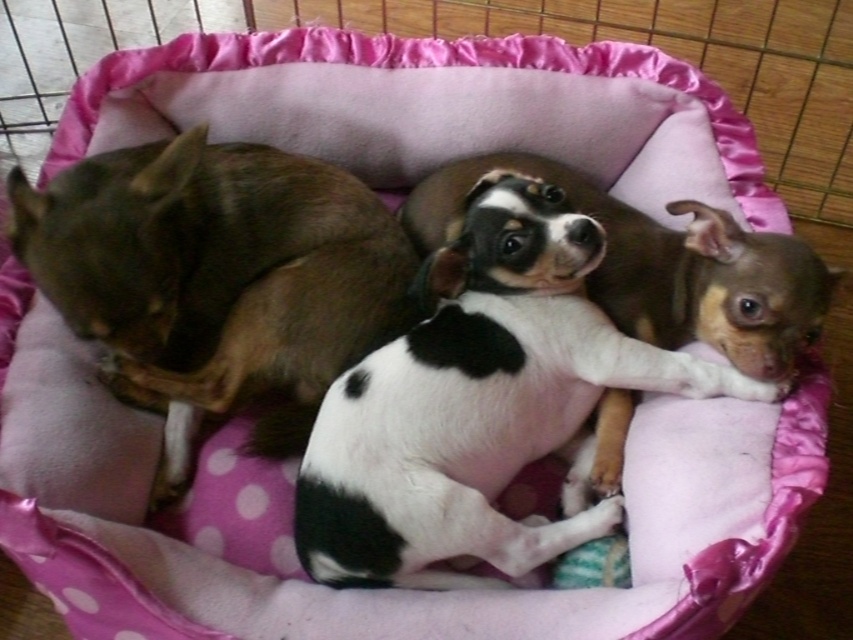
Is black and white fur at center further to camera compared to brown furry dog at left?

No, it is not.

Who is lower down, black and white fur at center or brown furry dog at left?

black and white fur at center is below.

This screenshot has width=853, height=640. In order to click on black and white fur at center in this screenshot , I will do `click(480, 404)`.